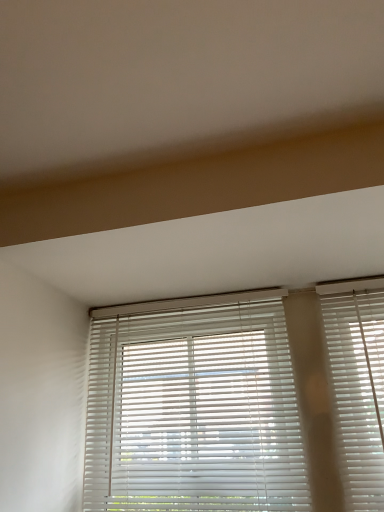
This screenshot has width=384, height=512. What do you see at coordinates (194, 409) in the screenshot? I see `white plastic blinds at center` at bounding box center [194, 409].

You are a GUI agent. You are given a task and a screenshot of the screen. Output one action in this format:
    pyautogui.click(x=<x>, y=<y>)
    Task: Click on the white plastic blinds at center
    The width and height of the screenshot is (384, 512).
    Given the screenshot: What is the action you would take?
    pyautogui.click(x=194, y=409)

The height and width of the screenshot is (512, 384). Identify the location of white plastic blinds at center. (194, 409).